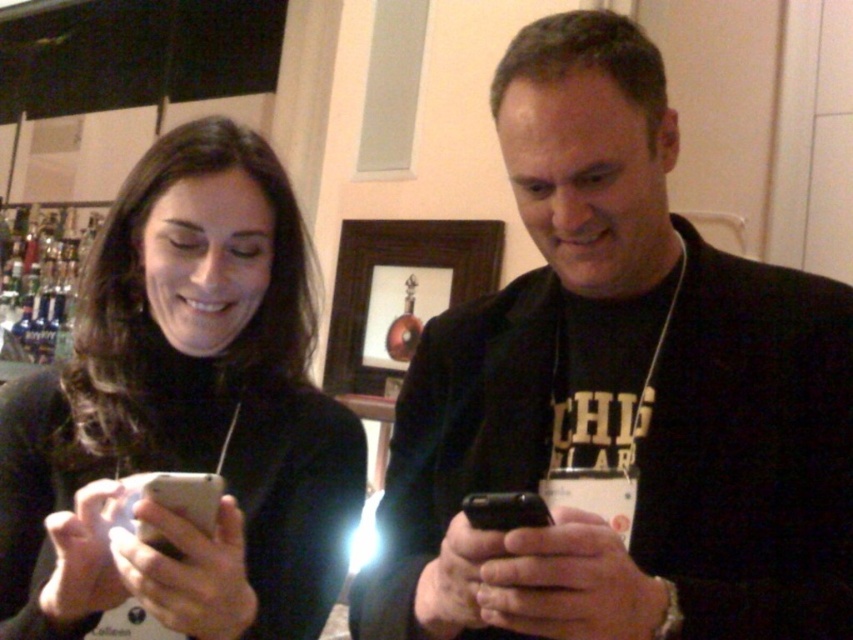
Does black matte phone at center have a greater width compared to black fabric t-shirt at center?

Indeed, black matte phone at center has a greater width compared to black fabric t-shirt at center.

Is point (601, 35) less distant than point (566, 401)?

Yes, point (601, 35) is in front of point (566, 401).

Locate an element on the screen. The height and width of the screenshot is (640, 853). black matte phone at center is located at coordinates (619, 390).

Is black matte phone at center shorter than matte black phone at left?

No, black matte phone at center is not shorter than matte black phone at left.

Can you confirm if black matte phone at center is positioned above matte black phone at left?

Yes, black matte phone at center is above matte black phone at left.

Image resolution: width=853 pixels, height=640 pixels. Identify the location of black matte phone at center. (619, 390).

Who is taller, black fabric t-shirt at center or black glossy smartphone at center?

With more height is black fabric t-shirt at center.

Is black fabric t-shirt at center thinner than black glossy smartphone at center?

Incorrect, black fabric t-shirt at center's width is not less than black glossy smartphone at center's.

Image resolution: width=853 pixels, height=640 pixels. Describe the element at coordinates (598, 428) in the screenshot. I see `black fabric t-shirt at center` at that location.

You are a GUI agent. You are given a task and a screenshot of the screen. Output one action in this format:
    pyautogui.click(x=<x>, y=<y>)
    Task: Click on the black fabric t-shirt at center
    This screenshot has height=640, width=853.
    Given the screenshot: What is the action you would take?
    pyautogui.click(x=598, y=428)